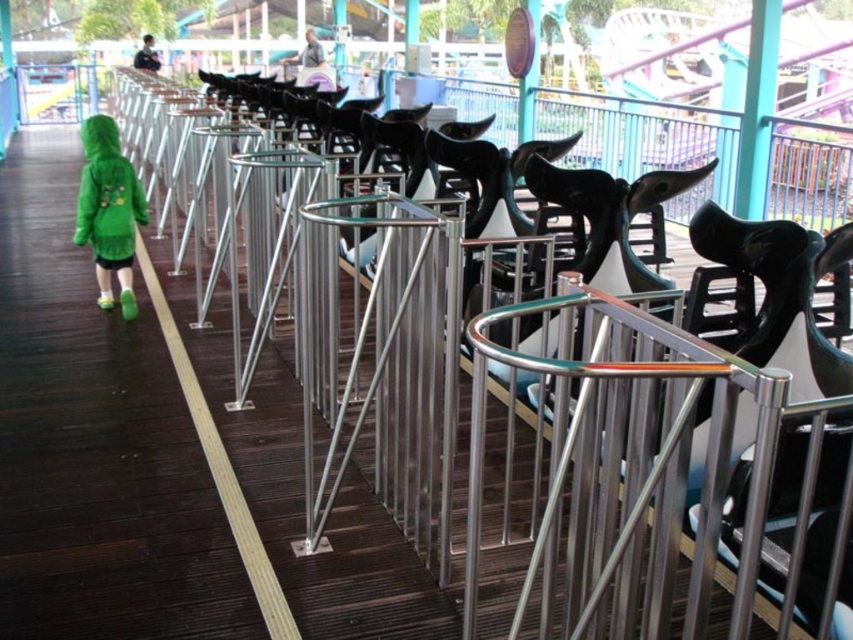
Question: Which point is closer to the camera?

Choices:
 (A) blue metallic pole at upper right
 (B) green matte jacket at left

Answer: (B)

Question: Estimate the real-world distances between objects in this image. Which object is farther from the green matte jacket at left?

Choices:
 (A) brushed metal sign at upper center
 (B) blue metallic pole at upper right

Answer: (A)

Question: Can you confirm if green matte jacket at left is positioned to the right of brushed metal sign at upper center?

Choices:
 (A) no
 (B) yes

Answer: (A)

Question: Which object appears closest to the camera in this image?

Choices:
 (A) blue metallic pole at upper right
 (B) brushed metal sign at upper center
 (C) green matte jacket at left

Answer: (C)

Question: Does blue metallic pole at upper right appear over brushed metal sign at upper center?

Choices:
 (A) yes
 (B) no

Answer: (B)

Question: Is blue metallic pole at upper right wider than brushed metal sign at upper center?

Choices:
 (A) yes
 (B) no

Answer: (A)